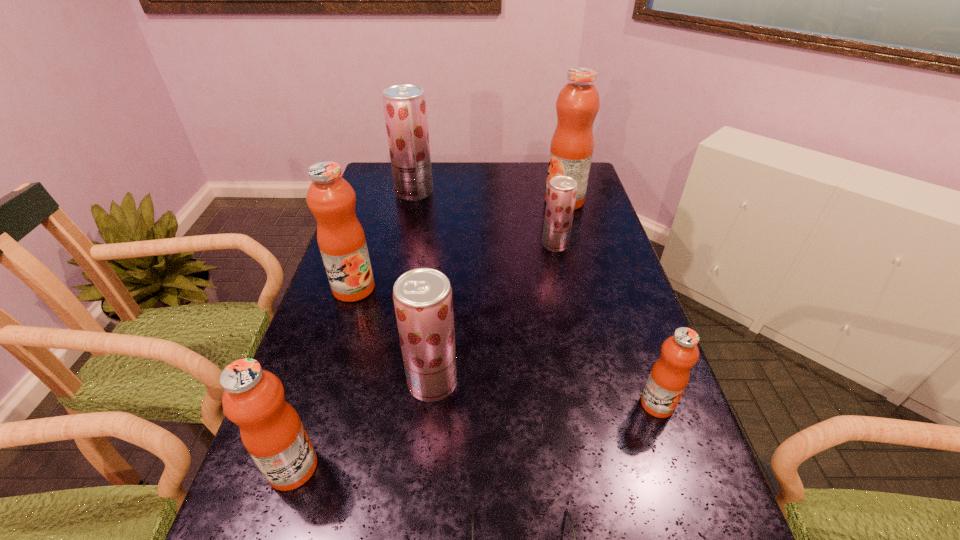
At what (x,y) coordinates should I click in order to perform the action: click on the tallest fruit juice. Please return your answer as a coordinate pair (x, y). This screenshot has width=960, height=540. Looking at the image, I should click on (571, 149).

The height and width of the screenshot is (540, 960). Identify the location of the farthest orange fruit juice. (571, 149).

Identify the location of the biggest strawberry fruit juice. The image size is (960, 540). (405, 110).

This screenshot has width=960, height=540. Identify the location of the leftmost strawberry fruit juice. (405, 110).

Where is `the third nearest orange fruit juice`? Image resolution: width=960 pixels, height=540 pixels. the third nearest orange fruit juice is located at coordinates (331, 199).

Identify the location of the fourth farthest fruit juice. The width and height of the screenshot is (960, 540). (331, 199).

Find the location of a particular element. Image resolution: width=960 pixels, height=540 pixels. the nearest strawberry fruit juice is located at coordinates (422, 297).

Where is `the fifth object from right to left`? the fifth object from right to left is located at coordinates 422,297.

Image resolution: width=960 pixels, height=540 pixels. Identify the location of the second smallest orange fruit juice. (271, 431).

Where is `the nearest orange fruit juice`? This screenshot has width=960, height=540. the nearest orange fruit juice is located at coordinates (271, 431).